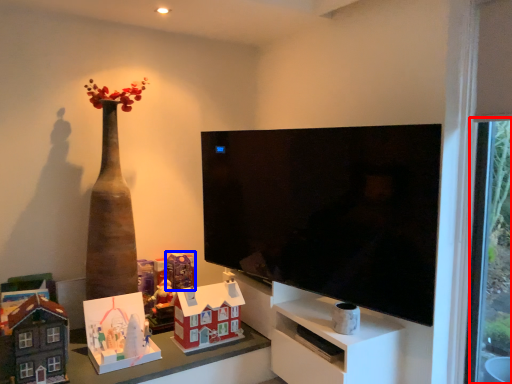
Question: Which of the following is the closest to the observer, glass door (highlighted by a red box) or toy (highlighted by a blue box)?

Choices:
 (A) glass door
 (B) toy

Answer: (A)